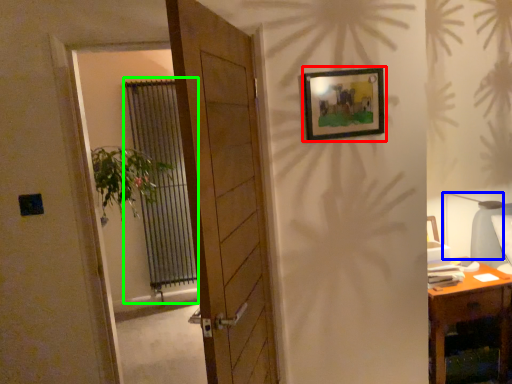
Question: Which object is the closest to the picture frame (highlighted by a red box)? Choose among these: table lamp (highlighted by a blue box) or curtain (highlighted by a green box).

Choices:
 (A) table lamp
 (B) curtain

Answer: (A)